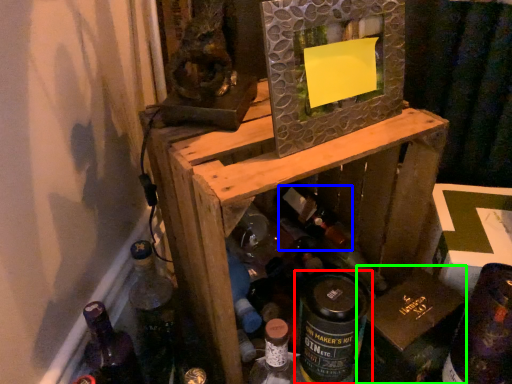
Question: Which object is positioned farthest from bottle (highlighted by a red box)? Select from wine bottle (highlighted by a blue box) and cardboard box (highlighted by a green box).

Choices:
 (A) wine bottle
 (B) cardboard box

Answer: (A)